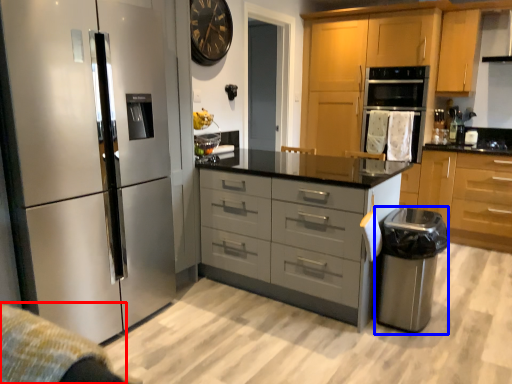
Question: Which of the following is the closest to the observer, gray (highlighted by a red box) or appliance (highlighted by a blue box)?

Choices:
 (A) gray
 (B) appliance

Answer: (A)